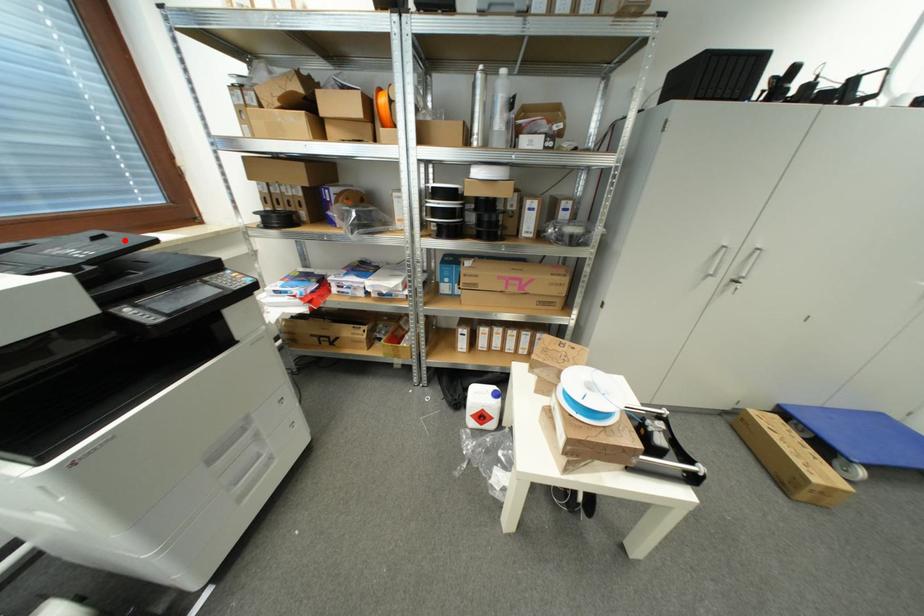
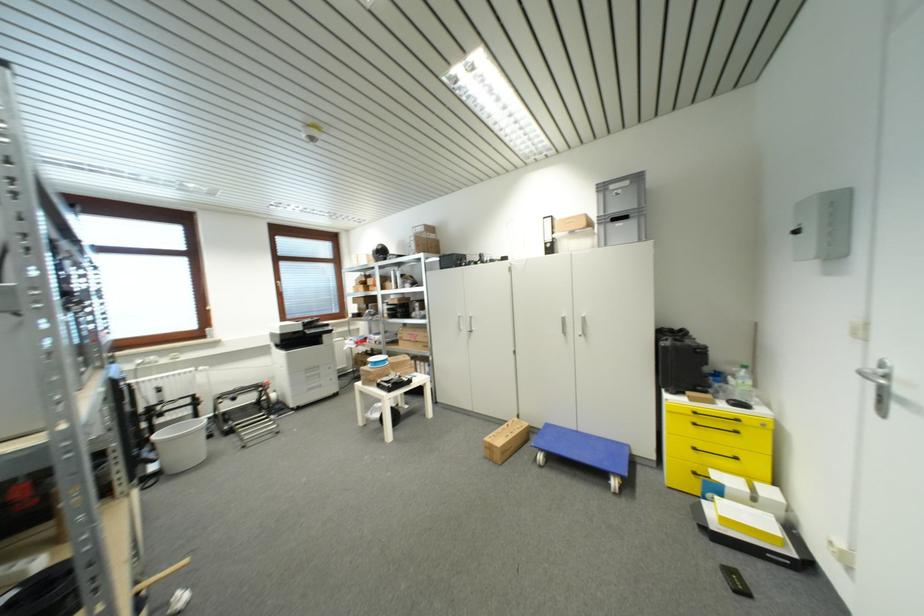
Where in the second image is the point corresponding to the highlighted location from the first image?

(320, 321)